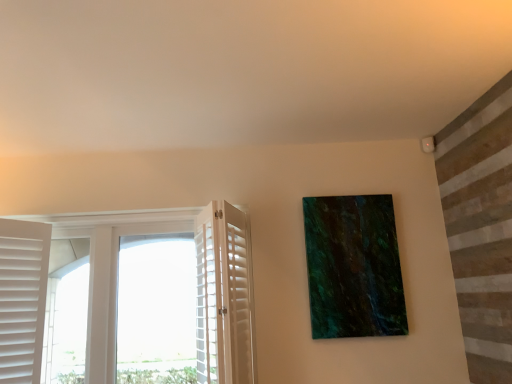
Question: Are green marble painting at upper right and white wood screen door at left located far from each other?

Choices:
 (A) yes
 (B) no

Answer: (B)

Question: Is green marble painting at upper right oriented away from white wood screen door at left?

Choices:
 (A) no
 (B) yes

Answer: (A)

Question: Is green marble painting at upper right in contact with white wood screen door at left?

Choices:
 (A) yes
 (B) no

Answer: (B)

Question: Is green marble painting at upper right positioned before white wood screen door at left?

Choices:
 (A) no
 (B) yes

Answer: (A)

Question: Can you confirm if green marble painting at upper right is positioned to the left of white wood screen door at left?

Choices:
 (A) yes
 (B) no

Answer: (B)

Question: Considering the relative sizes of green marble painting at upper right and white wood screen door at left in the image provided, is green marble painting at upper right thinner than white wood screen door at left?

Choices:
 (A) no
 (B) yes

Answer: (B)

Question: From a real-world perspective, is white wood screen door at left located beneath white wooden shutters at left?

Choices:
 (A) no
 (B) yes

Answer: (B)

Question: Considering the relative sizes of white wood screen door at left and white wooden shutters at left in the image provided, is white wood screen door at left smaller than white wooden shutters at left?

Choices:
 (A) yes
 (B) no

Answer: (A)

Question: Considering the relative positions of white wood screen door at left and white wooden shutters at left in the image provided, is white wood screen door at left to the left of white wooden shutters at left from the viewer's perspective?

Choices:
 (A) yes
 (B) no

Answer: (B)

Question: Is white wood screen door at left completely or partially outside of white wooden shutters at left?

Choices:
 (A) no
 (B) yes

Answer: (B)

Question: Does white wood screen door at left come in front of white wooden shutters at left?

Choices:
 (A) no
 (B) yes

Answer: (B)

Question: Can you confirm if white wood screen door at left is wider than white wooden shutters at left?

Choices:
 (A) yes
 (B) no

Answer: (B)

Question: Would you say white wooden shutters at left is outside green marble painting at upper right?

Choices:
 (A) no
 (B) yes

Answer: (B)